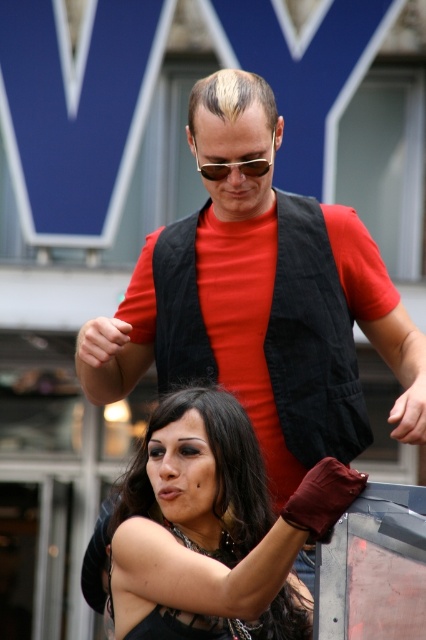
You are a photographer trying to capture a candid shot of the two people in the scene. You notice the matte black vest at upper center and the shiny black hair at lower center. Which object should you focus on first if you want to ensure both are in focus without adjusting the camera settings?

The matte black vest at upper center is much taller than the shiny black hair at lower center. To ensure both are in focus, you should focus on the matte black vest at upper center first since it is farther away, allowing the depth of field to cover the closer shiny black hair at lower center.

You are an observer at a public event. You notice two items in the scene described in the scene. The items are the matte black vest at upper center and the sunglasses at center. Which item is located closer to the bottom of the image?

The matte black vest at upper center is positioned under the sunglasses at center, so the matte black vest at upper center is closer to the bottom of the image.

You are a photographer trying to capture a candid shot of both the shiny black hair at lower center and the sunglasses at center. Based on their positions, which object should you focus on first to ensure both are in the frame?

Since the shiny black hair at lower center is in front of the sunglasses at center, you should focus on the sunglasses at center first to ensure both are visible in the frame.